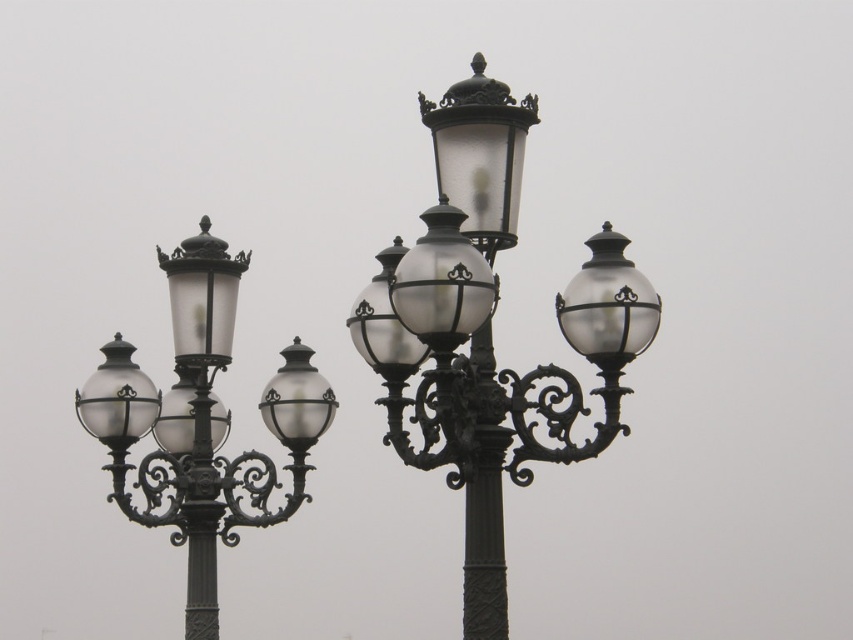
You are a city planner designing a new pedestrian walkway between the matte black street light at left and the satin silver globe at center. The walkway must be 8 meters long. Can the walkway fit between them without needing to move either object?

The distance between the matte black street light at left and the satin silver globe at center is 7.90 meters, which is slightly shorter than the required 8 meters. Therefore, the walkway cannot fit between them without moving one of the objects to increase the distance.

You are standing on the street looking at the two ornate street lamps. There are two points marked on the image, one at point coordinates point [111,401] and another at point coordinates point [312,413]. Which point is closer to you?

Point [111,401] is closer to you because it is further to the viewer than point [312,413].

You are standing at the point marked by coordinates point [490,330]. Looking around, you see two ornate street lamps described in the scene. Which direction should you face to see the smaller of the two street lamps?

The point [490,330] marks the matte black street light at center. Since the smaller lamp is on the left, you should face towards the left to see the smaller street lamp.